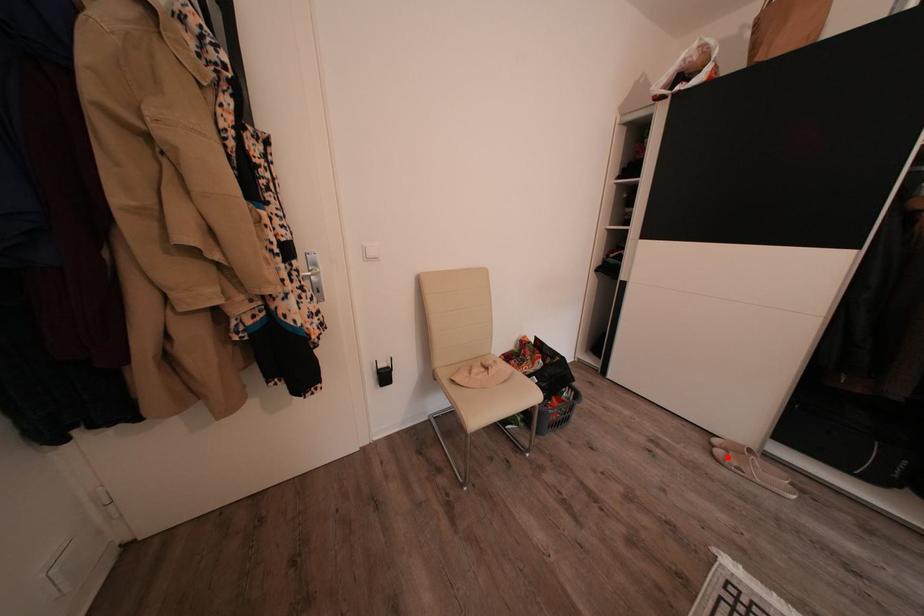
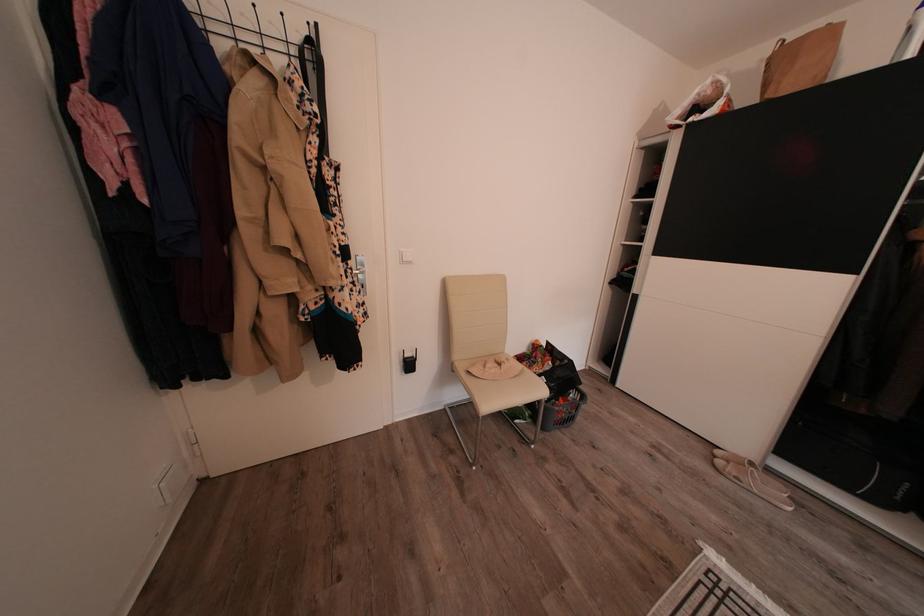
Find the pixel in the second image that matches the highlighted location in the first image.

(728, 468)